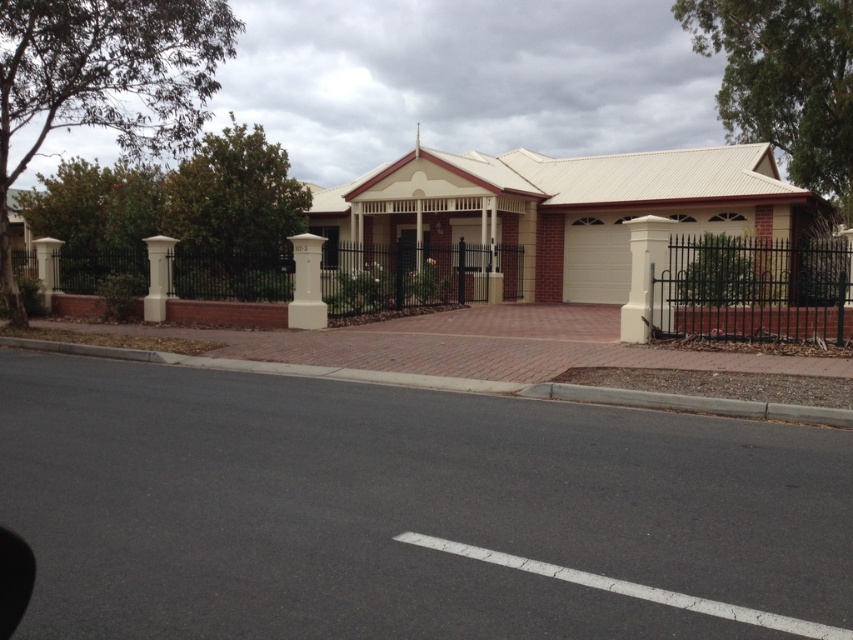
Question: Can you confirm if white smooth post at left is positioned to the right of white smooth pillar at left?

Choices:
 (A) no
 (B) yes

Answer: (B)

Question: Which object is the farthest from the white smooth post at left?

Choices:
 (A) white smooth pillar at center
 (B) white smooth pillar at left

Answer: (A)

Question: Can you confirm if white smooth post at center is positioned below white smooth pillar at left?

Choices:
 (A) no
 (B) yes

Answer: (B)

Question: Which object is positioned farthest from the white smooth pillar at left?

Choices:
 (A) white smooth pillar at center
 (B) white smooth post at center

Answer: (A)

Question: Is white smooth post at left below white smooth pillar at left?

Choices:
 (A) no
 (B) yes

Answer: (B)

Question: Which of the following is the closest to the observer?

Choices:
 (A) (167, 282)
 (B) (634, 298)
 (C) (309, 257)
 (D) (48, 262)

Answer: (B)